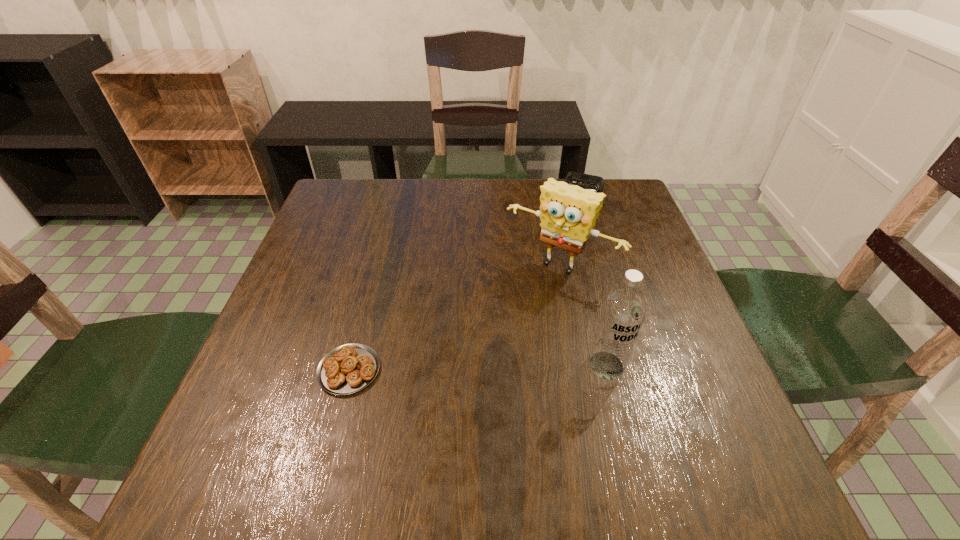
The height and width of the screenshot is (540, 960). Find the location of `vacant space situated 0.340m on the face of the sponge`. vacant space situated 0.340m on the face of the sponge is located at coordinates (453, 397).

Locate an element on the screen. The height and width of the screenshot is (540, 960). object that is at the far edge is located at coordinates (585, 181).

Identify the location of object present at the near edge. The width and height of the screenshot is (960, 540). (349, 368).

Locate an element on the screen. object that is at the left edge is located at coordinates (349, 368).

Find the location of a particular element. alarm clock located at the right edge is located at coordinates (585, 181).

Image resolution: width=960 pixels, height=540 pixels. Find the location of `sponge that is at the right edge`. sponge that is at the right edge is located at coordinates (567, 212).

Identify the location of object that is at the near left corner. (349, 368).

Find the location of `object that is at the far right corner`. object that is at the far right corner is located at coordinates (585, 181).

Find the location of `vacant space at the far edge of the desktop`. vacant space at the far edge of the desktop is located at coordinates (408, 195).

The height and width of the screenshot is (540, 960). In the image, there is a desktop. Find the location of `vacant space at the near edge`. vacant space at the near edge is located at coordinates (406, 426).